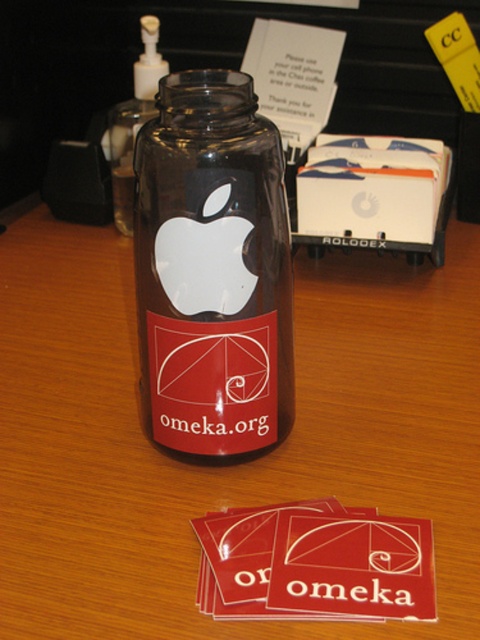
Does wooden table at center have a larger size compared to transparent glass bottle at center?

Correct, wooden table at center is larger in size than transparent glass bottle at center.

Between wooden table at center and transparent glass bottle at center, which one has more height?

transparent glass bottle at center is taller.

Which is in front, point (108, 408) or point (132, 176)?

Point (108, 408) is more forward.

The height and width of the screenshot is (640, 480). What are the coordinates of `wooden table at center` in the screenshot? It's located at (228, 465).

Does point (99, 566) come in front of point (134, 237)?

Yes, point (99, 566) is closer to viewer.

In the scene shown: Who is higher up, wooden table at center or transparent glass jar at center?

Positioned higher is transparent glass jar at center.

In order to click on wooden table at center in this screenshot , I will do click(228, 465).

Can you confirm if transparent glass jar at center is taller than transparent glass bottle at center?

In fact, transparent glass jar at center may be shorter than transparent glass bottle at center.

Can you confirm if transparent glass jar at center is positioned to the left of transparent glass bottle at center?

No, transparent glass jar at center is not to the left of transparent glass bottle at center.

Measure the distance between point (154,122) and camera.

The distance of point (154,122) from camera is 16.08 inches.

At what (x,y) coordinates should I click in order to perform the action: click on transparent glass jar at center. Please return your answer as a coordinate pair (x, y). The height and width of the screenshot is (640, 480). Looking at the image, I should click on (213, 269).